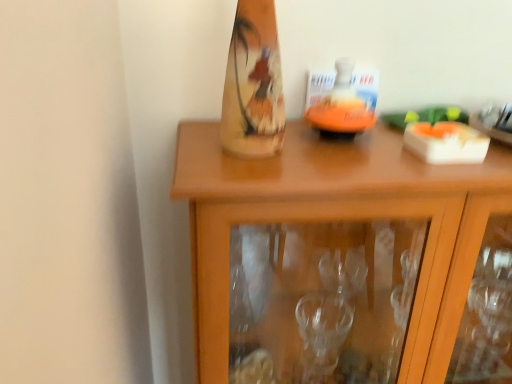
Question: From the image's perspective, is wooden cabinet at center located above or below orange matte candle holder at center?

Choices:
 (A) above
 (B) below

Answer: (B)

Question: Looking at the image, does wooden cabinet at center seem bigger or smaller compared to orange matte candle holder at center?

Choices:
 (A) big
 (B) small

Answer: (A)

Question: From a real-world perspective, is wooden cabinet at center above or below orange matte candle holder at center?

Choices:
 (A) above
 (B) below

Answer: (B)

Question: Considering the positions of orange matte candle holder at center and wooden cabinet at center in the image, is orange matte candle holder at center taller or shorter than wooden cabinet at center?

Choices:
 (A) short
 (B) tall

Answer: (A)

Question: From the image's perspective, is orange matte candle holder at center above or below wooden cabinet at center?

Choices:
 (A) above
 (B) below

Answer: (A)

Question: From a real-world perspective, is orange matte candle holder at center above or below wooden cabinet at center?

Choices:
 (A) below
 (B) above

Answer: (B)

Question: Is orange matte candle holder at center inside the boundaries of wooden cabinet at center, or outside?

Choices:
 (A) outside
 (B) inside

Answer: (A)